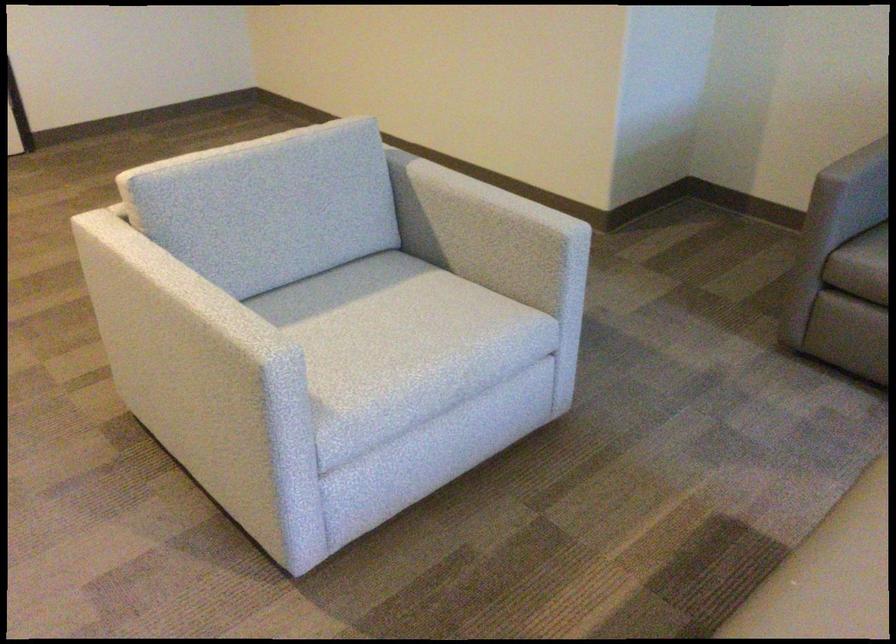
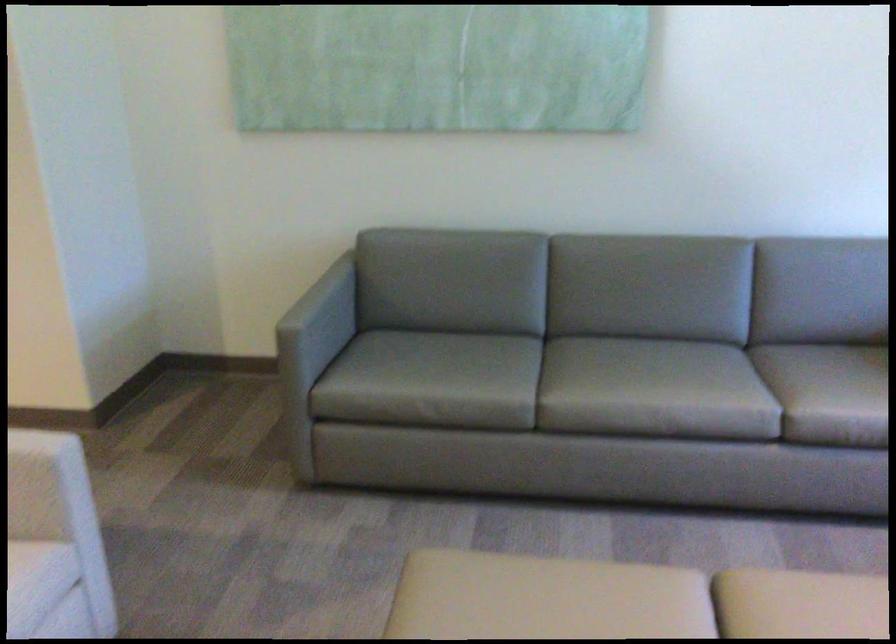
Question: The camera is either moving clockwise (left) or counter-clockwise (right) around the object. The first image is from the beginning of the video and the second image is from the end. Is the camera moving left or right when shooting the video?

Choices:
 (A) Left
 (B) Right

Answer: (A)